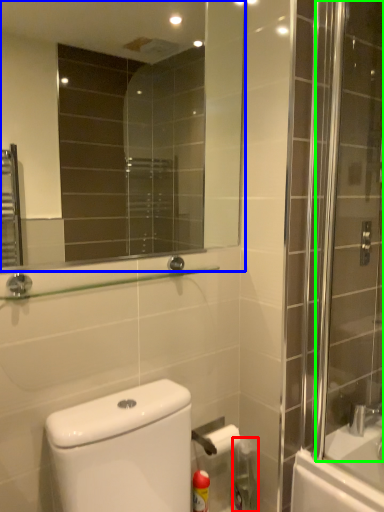
Question: Considering the real-world distances, which object is closest to cleaning product (highlighted by a red box)? mirror (highlighted by a blue box) or screen door (highlighted by a green box).

Choices:
 (A) mirror
 (B) screen door

Answer: (B)